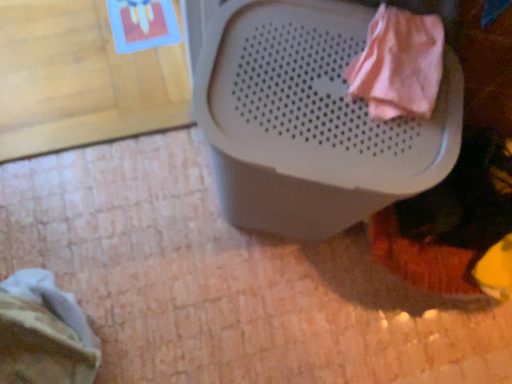
Where is `pink fabric at upper right, which is the 1th clothing from top to bottom`? Image resolution: width=512 pixels, height=384 pixels. pink fabric at upper right, which is the 1th clothing from top to bottom is located at coordinates (399, 64).

Locate an element on the screen. The width and height of the screenshot is (512, 384). white plastic waste container at upper center is located at coordinates (310, 120).

From the image's perspective, which one is positioned higher, pink fabric at upper right, which is the 1th clothing from top to bottom, or striped fabric at lower left, positioned as the 2th clothing in front-to-back order?

pink fabric at upper right, which is the 1th clothing from top to bottom, from the image's perspective.

How many degrees apart are the facing directions of pink fabric at upper right, which appears as the 1th clothing when viewed from the right, and striped fabric at lower left, which is the second clothing from right to left?

They differ by 115 degrees in their facing directions.

Is pink fabric at upper right, the 2th clothing when ordered from bottom to top, not inside striped fabric at lower left, positioned as the 2th clothing in top-to-bottom order?

Indeed, pink fabric at upper right, the 2th clothing when ordered from bottom to top, is completely outside striped fabric at lower left, positioned as the 2th clothing in top-to-bottom order.

Considering their positions, is striped fabric at lower left, which ranks as the first clothing in left-to-right order, located in front of or behind white plastic waste container at upper center?

Clearly, striped fabric at lower left, which ranks as the first clothing in left-to-right order, is behind white plastic waste container at upper center.

From a real-world perspective, is striped fabric at lower left, positioned as the 2th clothing in front-to-back order, above or below white plastic waste container at upper center?

From a real-world perspective, striped fabric at lower left, positioned as the 2th clothing in front-to-back order, is physically below white plastic waste container at upper center.

Is striped fabric at lower left, the first clothing ordered from the bottom, completely or partially outside of white plastic waste container at upper center?

striped fabric at lower left, the first clothing ordered from the bottom, is positioned outside white plastic waste container at upper center.

Between striped fabric at lower left, the first clothing ordered from the bottom, and white plastic waste container at upper center, which one has less height?

striped fabric at lower left, the first clothing ordered from the bottom.

Locate an element on the screen. This screenshot has height=384, width=512. clothing located below the white plastic waste container at upper center (from the image's perspective) is located at coordinates (44, 333).

From the image's perspective, is white plastic waste container at upper center beneath striped fabric at lower left, marked as the 1th clothing in a back-to-front arrangement?

No, from the image's perspective, white plastic waste container at upper center is not beneath striped fabric at lower left, marked as the 1th clothing in a back-to-front arrangement.

Which is more to the right, white plastic waste container at upper center or striped fabric at lower left, positioned as the 2th clothing in top-to-bottom order?

white plastic waste container at upper center is more to the right.

Which object is thinner, white plastic waste container at upper center or striped fabric at lower left, marked as the 1th clothing in a back-to-front arrangement?

Thinner between the two is striped fabric at lower left, marked as the 1th clothing in a back-to-front arrangement.

Is white plastic waste container at upper center far away from pink fabric at upper right, the 2th clothing positioned from the back?

white plastic waste container at upper center is actually quite close to pink fabric at upper right, the 2th clothing positioned from the back.

Does point (230, 31) come behind point (362, 73)?

Yes, point (230, 31) is behind point (362, 73).

Which of these two, white plastic waste container at upper center or pink fabric at upper right, which appears as the 1th clothing when viewed from the right, is bigger?

With larger size is white plastic waste container at upper center.

Is white plastic waste container at upper center taller than pink fabric at upper right, marked as the first clothing in a front-to-back arrangement?

Yes, white plastic waste container at upper center is taller than pink fabric at upper right, marked as the first clothing in a front-to-back arrangement.

From the image's perspective, who appears lower, striped fabric at lower left, positioned as the 2th clothing in front-to-back order, or pink fabric at upper right, which appears as the 1th clothing when viewed from the right?

striped fabric at lower left, positioned as the 2th clothing in front-to-back order.

Visually, is striped fabric at lower left, which is the second clothing from right to left, positioned to the left or to the right of pink fabric at upper right, marked as the first clothing in a front-to-back arrangement?

striped fabric at lower left, which is the second clothing from right to left, is positioned on pink fabric at upper right, marked as the first clothing in a front-to-back arrangement,'s left side.

Based on their sizes in the image, would you say striped fabric at lower left, marked as the 1th clothing in a back-to-front arrangement, is bigger or smaller than pink fabric at upper right, marked as the first clothing in a front-to-back arrangement?

Clearly, striped fabric at lower left, marked as the 1th clothing in a back-to-front arrangement, is larger in size than pink fabric at upper right, marked as the first clothing in a front-to-back arrangement.

Does pink fabric at upper right, the 2th clothing when ordered from bottom to top, have a larger size compared to white plastic waste container at upper center?

Incorrect, pink fabric at upper right, the 2th clothing when ordered from bottom to top, is not larger than white plastic waste container at upper center.

Is pink fabric at upper right, which appears as the 1th clothing when viewed from the right, facing away from white plastic waste container at upper center?

pink fabric at upper right, which appears as the 1th clothing when viewed from the right, is not turned away from white plastic waste container at upper center.

Considering the relative sizes of pink fabric at upper right, the 2th clothing positioned from the back, and white plastic waste container at upper center in the image provided, is pink fabric at upper right, the 2th clothing positioned from the back, thinner than white plastic waste container at upper center?

Yes, pink fabric at upper right, the 2th clothing positioned from the back, is thinner than white plastic waste container at upper center.

Image resolution: width=512 pixels, height=384 pixels. In order to click on clothing behind the pink fabric at upper right, which appears as the 1th clothing when viewed from the right in this screenshot , I will do `click(44, 333)`.

Identify the location of clothing on the left of white plastic waste container at upper center. (44, 333).

When comparing their distances from pink fabric at upper right, marked as the first clothing in a front-to-back arrangement, does striped fabric at lower left, which ranks as the first clothing in left-to-right order, or white plastic waste container at upper center seem closer?

white plastic waste container at upper center is closer to pink fabric at upper right, marked as the first clothing in a front-to-back arrangement.

Estimate the real-world distances between objects in this image. Which object is further from white plastic waste container at upper center, striped fabric at lower left, which ranks as the first clothing in left-to-right order, or pink fabric at upper right, the second clothing viewed from the left?

striped fabric at lower left, which ranks as the first clothing in left-to-right order, lies further to white plastic waste container at upper center than the other object.

When comparing their distances from pink fabric at upper right, the 2th clothing when ordered from bottom to top, does white plastic waste container at upper center or striped fabric at lower left, positioned as the 2th clothing in top-to-bottom order, seem further?

striped fabric at lower left, positioned as the 2th clothing in top-to-bottom order.

In the scene shown: Estimate the real-world distances between objects in this image. Which object is closer to striped fabric at lower left, marked as the 1th clothing in a back-to-front arrangement, white plastic waste container at upper center or pink fabric at upper right, the 2th clothing positioned from the back?

Based on the image, white plastic waste container at upper center appears to be nearer to striped fabric at lower left, marked as the 1th clothing in a back-to-front arrangement.

Which object lies further to the anchor point white plastic waste container at upper center, pink fabric at upper right, which is the 1th clothing from top to bottom, or striped fabric at lower left, the first clothing ordered from the bottom?

striped fabric at lower left, the first clothing ordered from the bottom, lies further to white plastic waste container at upper center than the other object.

Looking at this image, considering their positions, is pink fabric at upper right, the 2th clothing positioned from the back, positioned further to striped fabric at lower left, positioned as the 2th clothing in top-to-bottom order, than white plastic waste container at upper center?

The object further to striped fabric at lower left, positioned as the 2th clothing in top-to-bottom order, is pink fabric at upper right, the 2th clothing positioned from the back.

At what (x,y) coordinates should I click in order to perform the action: click on waste container between striped fabric at lower left, the first clothing ordered from the bottom, and pink fabric at upper right, which appears as the 1th clothing when viewed from the right, in the horizontal direction. Please return your answer as a coordinate pair (x, y). Image resolution: width=512 pixels, height=384 pixels. Looking at the image, I should click on 310,120.